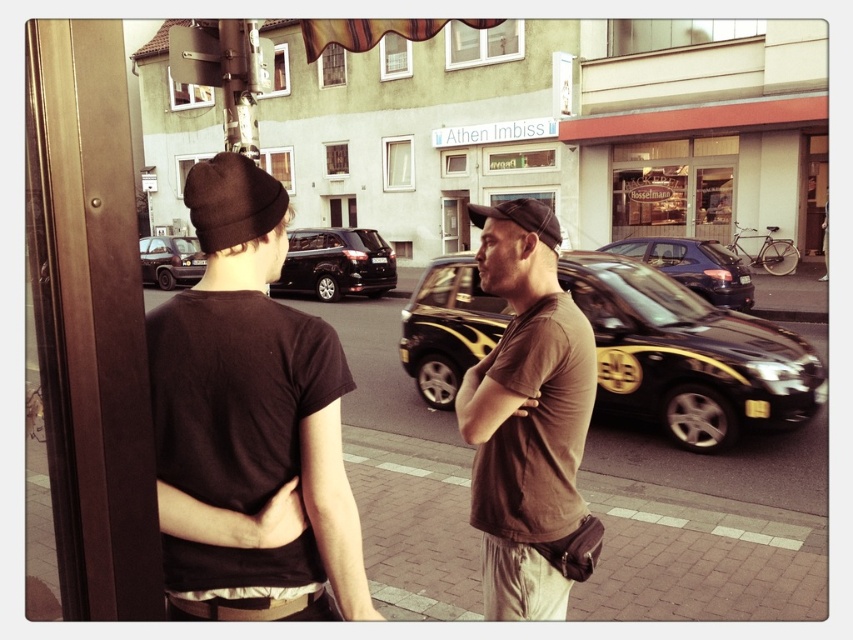
Question: Does black metallic car at center have a larger size compared to black knit cap at upper left?

Choices:
 (A) no
 (B) yes

Answer: (B)

Question: Is dark brown cotton t-shirt at center above black glossy taxi at center?

Choices:
 (A) no
 (B) yes

Answer: (A)

Question: Which is nearer to the shiny black suv at center?

Choices:
 (A) black metallic car at center
 (B) matte black van at left
 (C) black knit cap at upper left

Answer: (B)

Question: Is dark brown cotton t-shirt at center wider than matte black van at left?

Choices:
 (A) yes
 (B) no

Answer: (A)

Question: Estimate the real-world distances between objects in this image. Which object is farther from the black metallic car at center?

Choices:
 (A) black glossy taxi at center
 (B) matte black van at left
 (C) brown cotton shirt at center
 (D) shiny black suv at center

Answer: (B)

Question: Which object is the farthest from the black metallic car at center?

Choices:
 (A) brown cotton shirt at center
 (B) dark brown cotton t-shirt at center
 (C) black glossy taxi at center

Answer: (C)